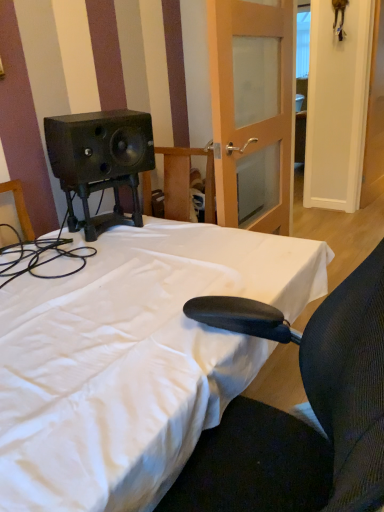
Question: From the image's perspective, would you say wooden frosted glass door at center, which is the first door in left-to-right order, is shown under white fabric bed at center?

Choices:
 (A) no
 (B) yes

Answer: (A)

Question: Considering the relative positions of wooden frosted glass door at center, which is the first door in left-to-right order, and white fabric bed at center in the image provided, is wooden frosted glass door at center, which is the first door in left-to-right order, to the left of white fabric bed at center from the viewer's perspective?

Choices:
 (A) yes
 (B) no

Answer: (B)

Question: Is wooden frosted glass door at center, the 2th door in the right-to-left sequence, located outside white fabric bed at center?

Choices:
 (A) no
 (B) yes

Answer: (B)

Question: Is wooden frosted glass door at center, the 2th door in the right-to-left sequence, next to white fabric bed at center and touching it?

Choices:
 (A) no
 (B) yes

Answer: (A)

Question: From the image's perspective, does wooden frosted glass door at center, which is the first door in left-to-right order, appear higher than white fabric bed at center?

Choices:
 (A) yes
 (B) no

Answer: (A)

Question: Is wooden frosted glass door at center, the 2th door in the right-to-left sequence, in front of or behind white wooden door at upper right, which appears as the second door when viewed from the left, in the image?

Choices:
 (A) front
 (B) behind

Answer: (A)

Question: Based on their positions, is wooden frosted glass door at center, the 2th door in the right-to-left sequence, located to the left or right of white wooden door at upper right, which is counted as the first door, starting from the right?

Choices:
 (A) left
 (B) right

Answer: (A)

Question: From a real-world perspective, relative to white wooden door at upper right, which is counted as the first door, starting from the right, is wooden frosted glass door at center, which is the first door in left-to-right order, vertically above or below?

Choices:
 (A) below
 (B) above

Answer: (B)

Question: From the image's perspective, relative to white wooden door at upper right, which appears as the second door when viewed from the left, is wooden frosted glass door at center, which is the first door in left-to-right order, above or below?

Choices:
 (A) below
 (B) above

Answer: (A)

Question: Does point (43, 294) appear closer or farther from the camera than point (360, 167)?

Choices:
 (A) farther
 (B) closer

Answer: (B)

Question: From the image's perspective, relative to white wooden door at upper right, which appears as the second door when viewed from the left, is white fabric bed at center above or below?

Choices:
 (A) above
 (B) below

Answer: (B)

Question: Is white fabric bed at center wider or thinner than white wooden door at upper right, which appears as the second door when viewed from the left?

Choices:
 (A) wide
 (B) thin

Answer: (A)

Question: From a real-world perspective, is white fabric bed at center physically located above or below white wooden door at upper right, which appears as the second door when viewed from the left?

Choices:
 (A) above
 (B) below

Answer: (B)

Question: From a real-world perspective, is white wooden door at upper right, which is counted as the first door, starting from the right, physically located above or below wooden frosted glass door at center, the 2th door in the right-to-left sequence?

Choices:
 (A) above
 (B) below

Answer: (B)

Question: From the image's perspective, is white wooden door at upper right, which is counted as the first door, starting from the right, located above or below wooden frosted glass door at center, the 2th door in the right-to-left sequence?

Choices:
 (A) above
 (B) below

Answer: (A)